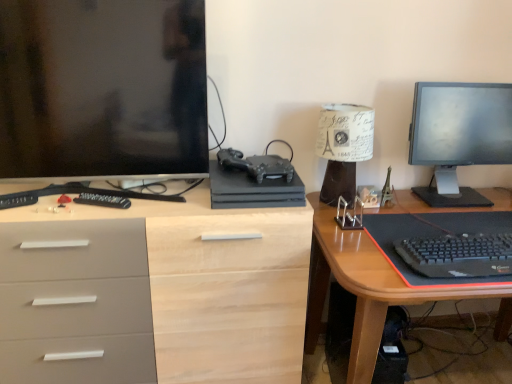
Image resolution: width=512 pixels, height=384 pixels. I want to click on free space to the left of black plastic remote control at left, which is counted as the 1th remote control, starting from the right, so click(44, 209).